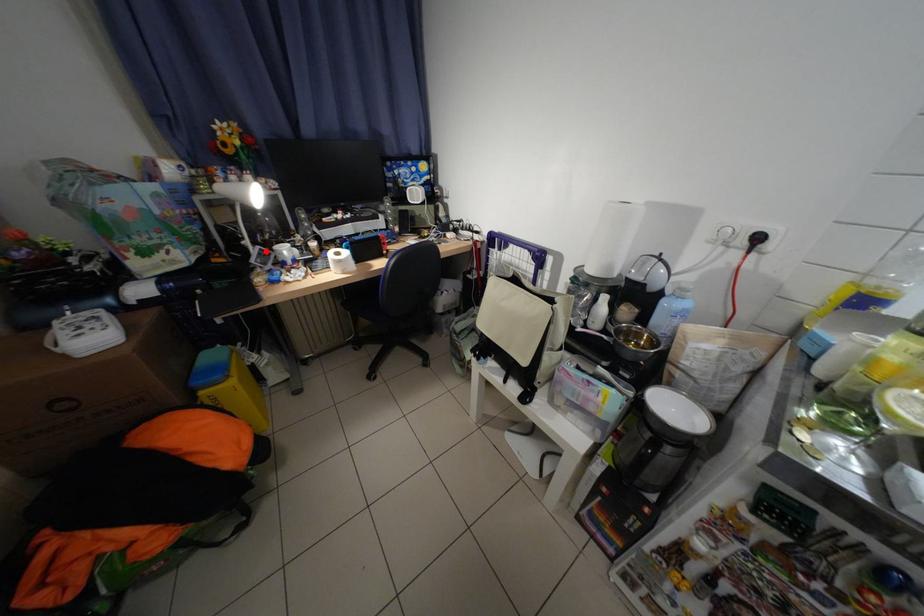
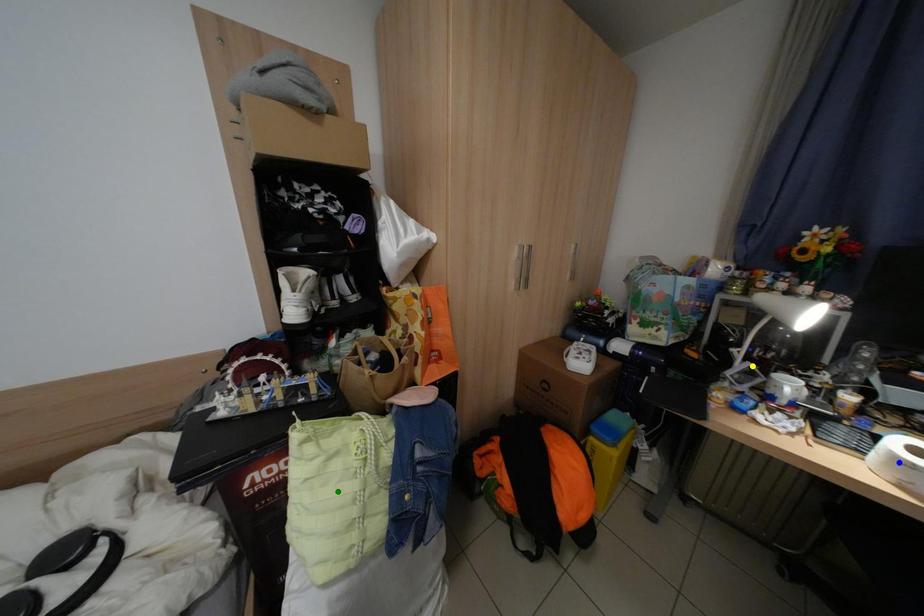
Question: I am providing you with two images of the same scene from different viewpoints. A red point is marked on the first image. You are given multiple points on the second image. Which mark in image 2 goes with the point in image 1?

Choices:
 (A) blue point
 (B) green point
 (C) yellow point

Answer: (C)